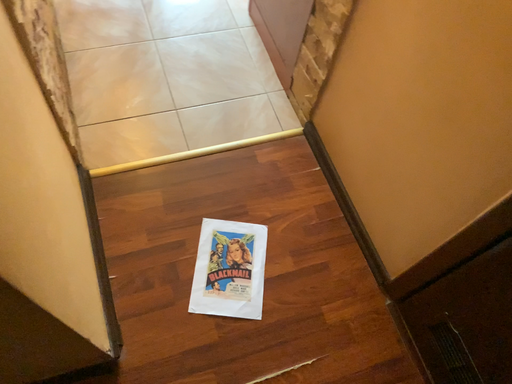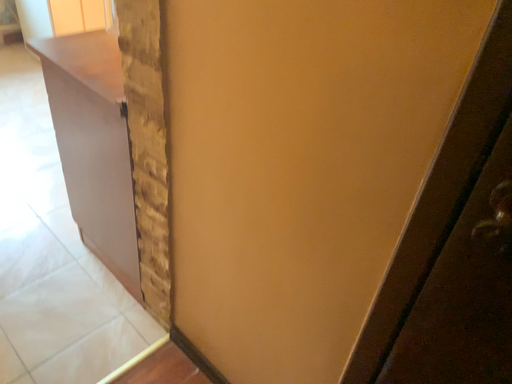
Question: How did the camera likely rotate when shooting the video?

Choices:
 (A) rotated left
 (B) rotated right

Answer: (B)